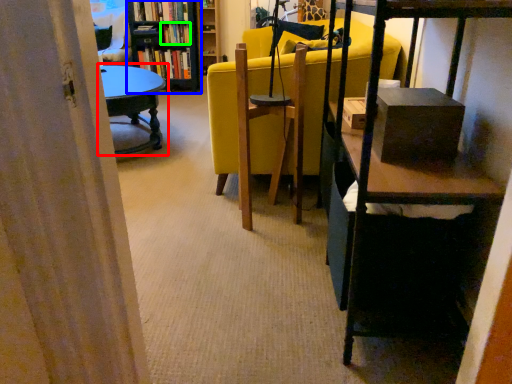
Question: Which is nearer to the table (highlighted by a red box)? bookcase (highlighted by a blue box) or book (highlighted by a green box).

Choices:
 (A) bookcase
 (B) book

Answer: (A)